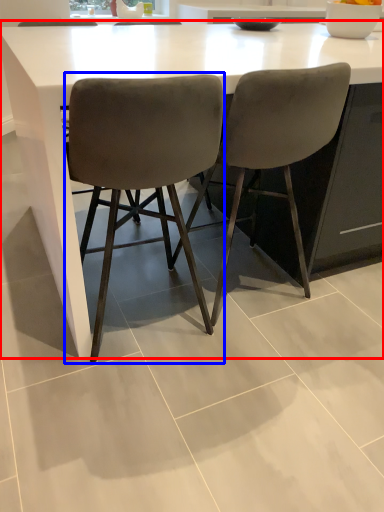
Question: Which object appears closest to the camera in this image, table (highlighted by a red box) or chair (highlighted by a blue box)?

Choices:
 (A) table
 (B) chair

Answer: (B)